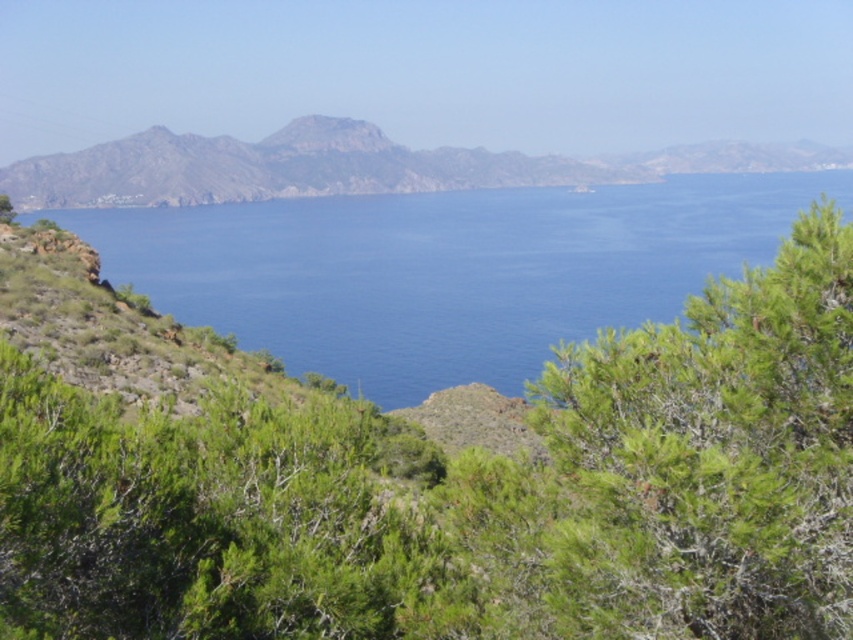
Between green leafy shrub at right and rugged brown mountain at center, which one has more height?

With more height is rugged brown mountain at center.

Identify the location of green leafy shrub at right. The height and width of the screenshot is (640, 853). (715, 456).

Can you confirm if green leafy shrubs at center is positioned above green leafy shrub at right?

No.

Where is `green leafy shrubs at center`? This screenshot has height=640, width=853. green leafy shrubs at center is located at coordinates (468, 493).

Is point (502, 481) positioned before point (604, 483)?

No, it is not.

Find the location of a particular element. green leafy shrubs at center is located at coordinates (468, 493).

Does point (759, 550) come closer to viewer compared to point (308, 368)?

Yes, it is in front of point (308, 368).

Which is in front, point (728, 394) or point (434, 348)?

Point (728, 394) is more forward.

Is point (735, 392) closer to camera compared to point (105, 253)?

Yes.

At what (x,y) coordinates should I click in order to perform the action: click on green leafy shrub at right. Please return your answer as a coordinate pair (x, y). The image size is (853, 640). Looking at the image, I should click on (715, 456).